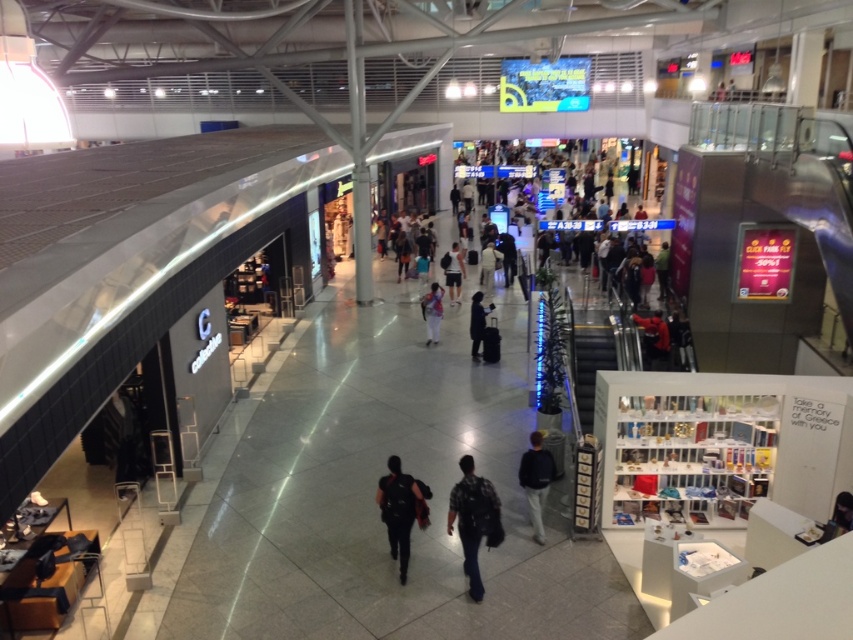
Is plaid shirt at center to the left of dark blue jeans at center from the viewer's perspective?

Correct, you'll find plaid shirt at center to the left of dark blue jeans at center.

Between plaid shirt at center and dark blue jeans at center, which one appears on the right side from the viewer's perspective?

dark blue jeans at center

Between point (495, 515) and point (456, 243), which one is positioned behind?

The point (456, 243) is behind.

Identify the location of plaid shirt at center. The image size is (853, 640). (473, 518).

Is plaid shirt at center shorter than denim jacket at center?

No.

Find the location of a particular element. This screenshot has height=640, width=853. plaid shirt at center is located at coordinates (473, 518).

Describe the element at coordinates (473, 518) in the screenshot. I see `plaid shirt at center` at that location.

This screenshot has height=640, width=853. Identify the location of plaid shirt at center. (473, 518).

Who is lower down, red leather jacket at center or dark blue fabric jacket at center?

Positioned lower is red leather jacket at center.

Who is positioned more to the right, red leather jacket at center or dark blue fabric jacket at center?

From the viewer's perspective, red leather jacket at center appears more on the right side.

Who is more forward, [662,330] or [490,305]?

Point [662,330] is more forward.

Identify the location of red leather jacket at center. Image resolution: width=853 pixels, height=640 pixels. (654, 339).